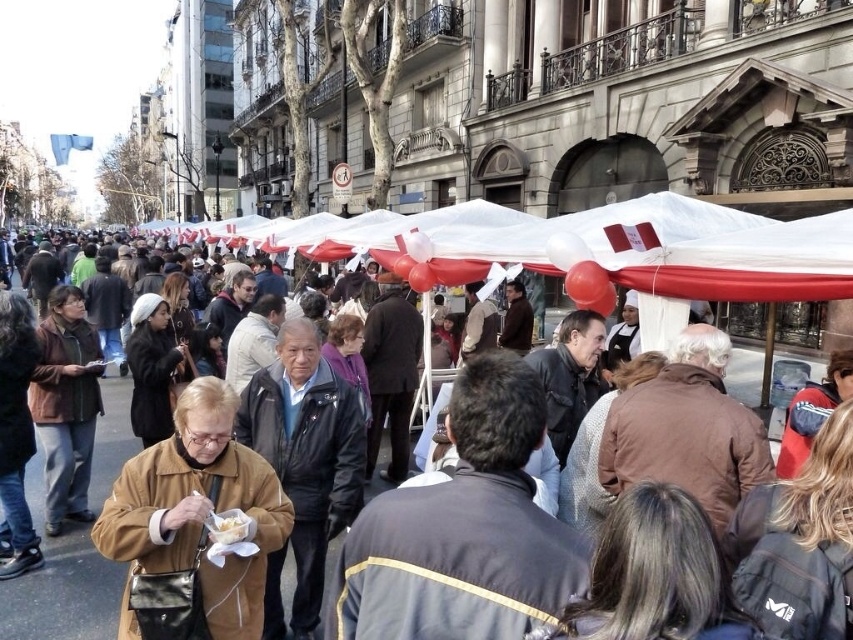
Which is behind, point (386, 444) or point (225, 528)?

The point (386, 444) is more distant.

Is point (15, 632) positioned behind point (231, 524)?

Yes, point (15, 632) is farther from viewer.

Is point (817, 364) positioned after point (228, 528)?

Yes, it is behind point (228, 528).

The width and height of the screenshot is (853, 640). I want to click on brown leather jacket at center, so click(x=62, y=593).

Which is more to the left, white paper bag at center or white paper food at center?

Positioned to the left is white paper bag at center.

This screenshot has height=640, width=853. In order to click on white paper bag at center in this screenshot , I will do `click(227, 525)`.

Is brown leather jacket at center to the left of white paper bag at center from the viewer's perspective?

No, brown leather jacket at center is not to the left of white paper bag at center.

Identify the location of brown leather jacket at center. The width and height of the screenshot is (853, 640). (62, 593).